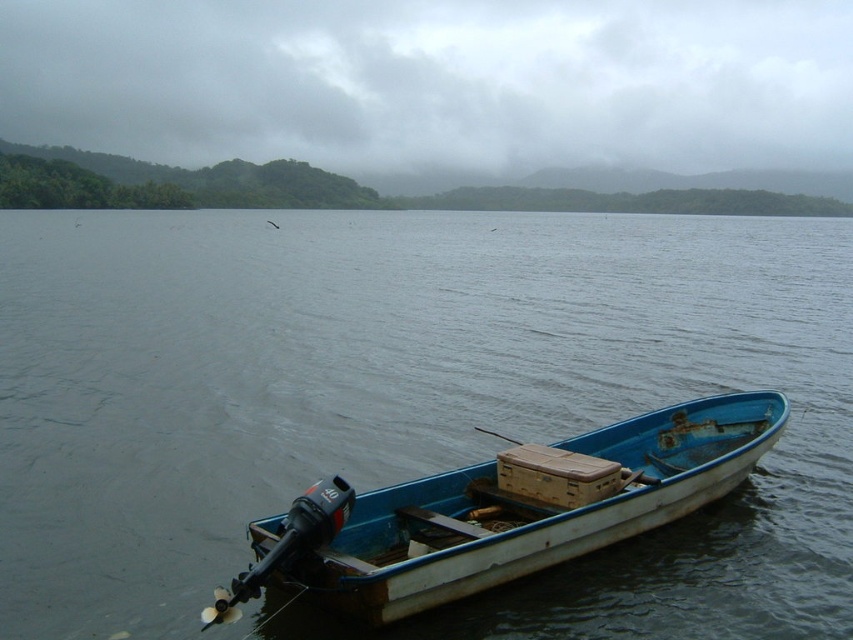
You are a fisherman planning to navigate through the water. You see the blue wooden boat at center and the blue wooden boat at lower right. Which boat is closer to you?

The blue wooden boat at center is closer to you because the blue wooden boat at lower right is behind it.

You are standing on a dock and see the blue wooden boat at center floating on the water. If you want to throw a lifebuoy to someone on the boat, and the lifebuoy has a throwing range of 6 meters, will you be able to reach them?

The blue wooden boat at center is 6.59 meters away from the viewer. Since the lifebuoy has a throwing range of 6 meters, you will not be able to reach them as the distance exceeds the lifebuoy range.

You are an observer standing on the dock and see two blue wooden boats in the water. Which boat is taller, the blue wooden boat at center or the blue wooden boat at lower right?

The blue wooden boat at center is taller than the blue wooden boat at lower right according to the description provided.